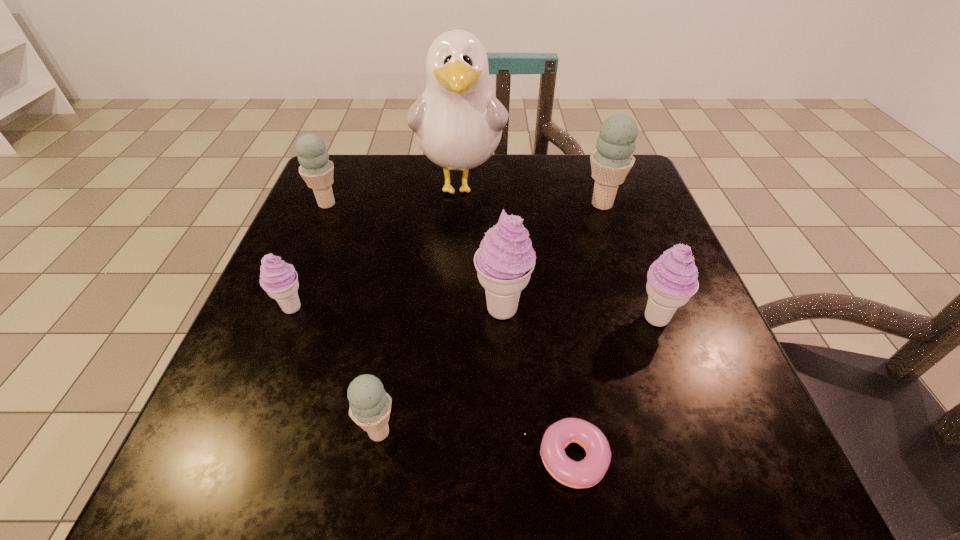
At what (x,y) coordinates should I click in order to perform the action: click on free space in the image that satisfies the following two spatial constraints: 1. on the back side of the biggest blue ice cream; 2. on the right side of the third ice cream from right to left. Please return your answer as a coordinate pair (x, y). This screenshot has width=960, height=540. Looking at the image, I should click on (497, 204).

In order to click on vacant area in the image that satisfies the following two spatial constraints: 1. on the front side of the smallest purple icecream; 2. on the right side of the nearest ice cream in this screenshot , I will do `click(242, 432)`.